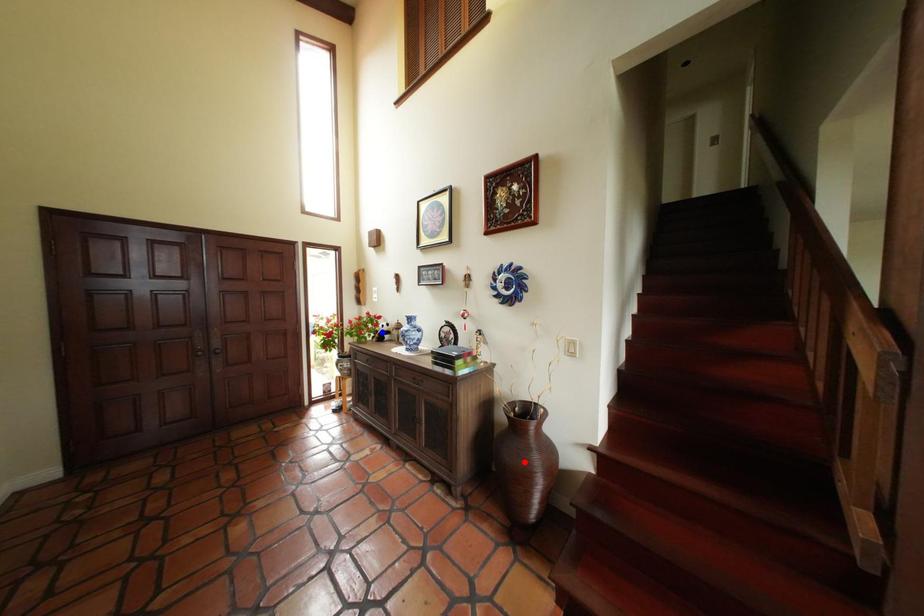
Question: Which of the two points in the image is closer to the camera?

Choices:
 (A) Blue point is closer.
 (B) Red point is closer.

Answer: (B)